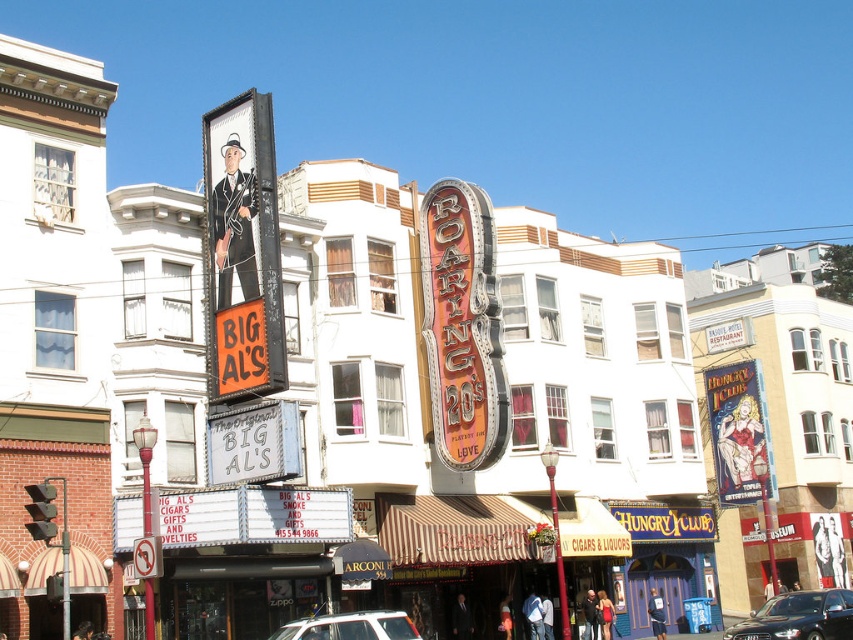
Question: Does shiny black sedan at center have a lesser width compared to white plastic car at center?

Choices:
 (A) yes
 (B) no

Answer: (A)

Question: Which object is farther from the camera taking this photo?

Choices:
 (A) shiny black sedan at center
 (B) metallic sign at upper left
 (C) gold metallic sign at center

Answer: (C)

Question: Which object is positioned farthest from the metallic sign at upper left?

Choices:
 (A) shiny black sedan at center
 (B) gold metallic sign at center

Answer: (A)

Question: Among these objects, which one is farthest from the camera?

Choices:
 (A) gold metallic sign at center
 (B) white plastic car at center

Answer: (A)

Question: In this image, where is metallic sign at upper left located relative to shiny black sedan at center?

Choices:
 (A) right
 (B) left

Answer: (B)

Question: Does gold metallic sign at center have a greater width compared to shiny black sedan at center?

Choices:
 (A) no
 (B) yes

Answer: (A)